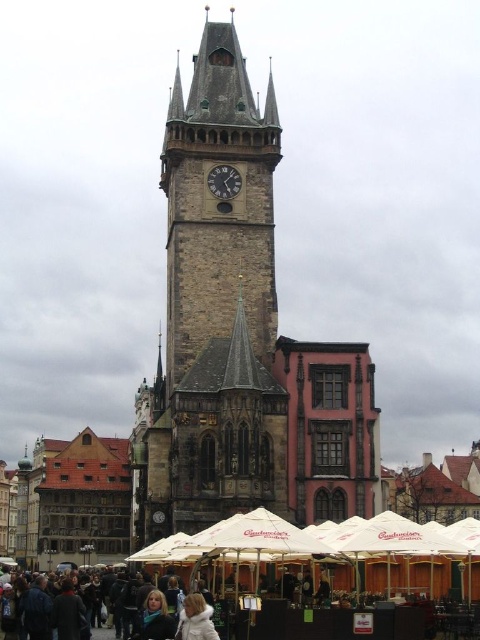
You are standing in the square and want to take a photo of the stone clock tower at center. You have a camera with a 50mm lens. The point representing the tower is at coordinates point (218, 204). If the camera is focused on the center of the image, will the tower be centered in your photo?

The stone clock tower at center is represented by point (218, 204). Since the camera is focused on the center of the image, which is at coordinates 0.5, 0.5, the tower will not be perfectly centered. It will appear slightly to the left and lower than the center point.

You are standing at the entrance of the square and want to take a photo of the stone clock tower at center. According to the coordinates provided, where should you position yourself to ensure the tower is centered in your camera frame?

The stone clock tower at center is located at coordinates point (218, 204), so positioning yourself at those coordinates would center it in your camera frame.

You are a tourist standing in the square and see the stone clock tower at center and the dark gray stone clock at center. Which one is positioned to the left?

The stone clock tower at center is to the left of the dark gray stone clock at center.